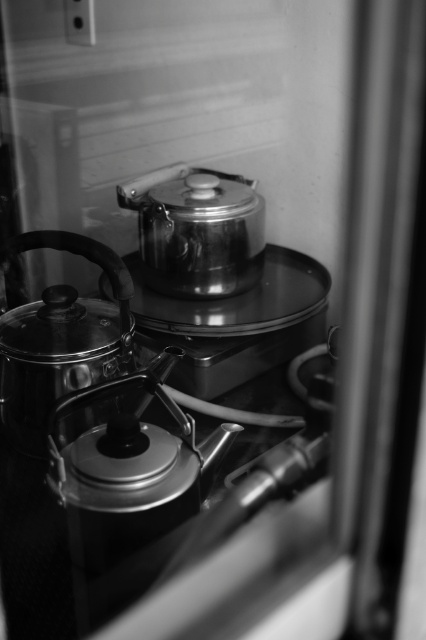
What object is located at the coordinates point (129, 470) in the image?

The shiny metallic teapot at center is located at point (129, 470).

You are standing in front of a stove and see two points marked on the stovetop. The first point is at coordinates point (135,320) and the second is at point (42,385). If you want to place a new pot between them, which point should you move closer to ensure the pot is centered between them?

To center the pot between point (135,320) and point (42,385), you should move it closer to point (42,385) since point (135,320) is behind point (42,385).